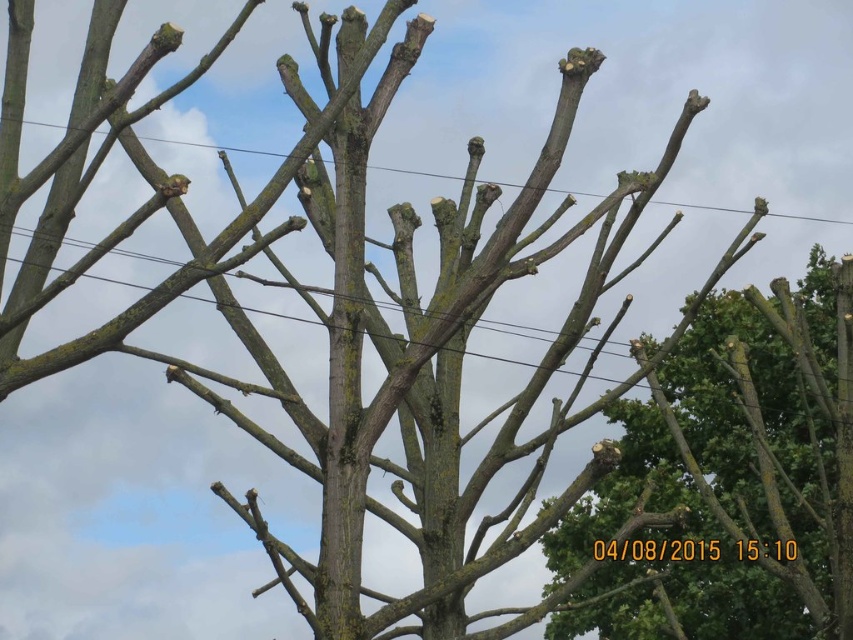
You are a bird looking for a place to perch. You see the brown wood power line at upper center and the brown rough wood at center. Which one has more space for you to land?

The brown rough wood at center has more space for you to land because the brown wood power line at upper center occupies less space than it.

You are a tree surgeon assessing the two brown rough bark at right and brown rough wood at center. Which one has a greater height?

The brown rough bark at right is much taller than brown rough wood at center.

You are a bird looking for a place to perch. You see the brown wood power line at upper center and the brown rough wood at center. Which one is higher up in the image?

The brown wood power line at upper center is located above the brown rough wood at center, so it is higher up in the image.